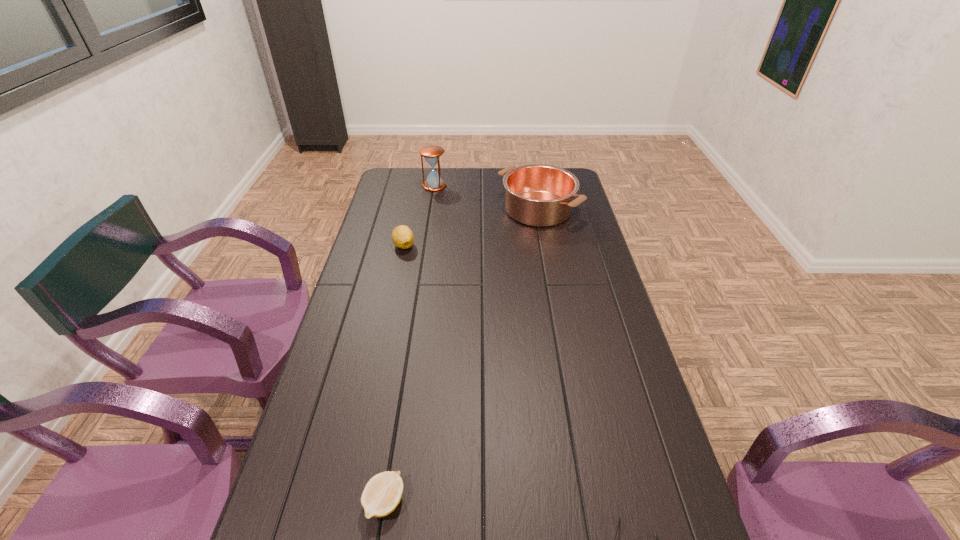
The image size is (960, 540). I want to click on hourglass situated at the far edge, so click(x=432, y=153).

This screenshot has height=540, width=960. Identify the location of saucepan at the far edge. (539, 195).

This screenshot has width=960, height=540. I want to click on object that is at the left edge, so click(x=402, y=236).

Where is `object positioned at the right edge`? object positioned at the right edge is located at coordinates (539, 195).

The width and height of the screenshot is (960, 540). In order to click on object present at the far right corner in this screenshot , I will do `click(539, 195)`.

The image size is (960, 540). In the image, there is a desktop. Find the location of `vacant space at the far edge`. vacant space at the far edge is located at coordinates (484, 186).

This screenshot has width=960, height=540. What are the coordinates of `vacant region at the left edge` in the screenshot? It's located at (362, 311).

At what (x,y) coordinates should I click in order to perform the action: click on vacant area at the right edge of the desktop. Please return your answer as a coordinate pair (x, y). The image size is (960, 540). Looking at the image, I should click on (581, 244).

In the image, there is a desktop. Where is `free space at the far left corner`? The height and width of the screenshot is (540, 960). free space at the far left corner is located at coordinates (400, 193).

You are a GUI agent. You are given a task and a screenshot of the screen. Output one action in this format:
    pyautogui.click(x=<x>, y=<y>)
    Task: Click on the vacant space that is in between the farther lemon and the fourth tallest object
    This screenshot has height=540, width=960.
    Given the screenshot: What is the action you would take?
    pyautogui.click(x=395, y=374)